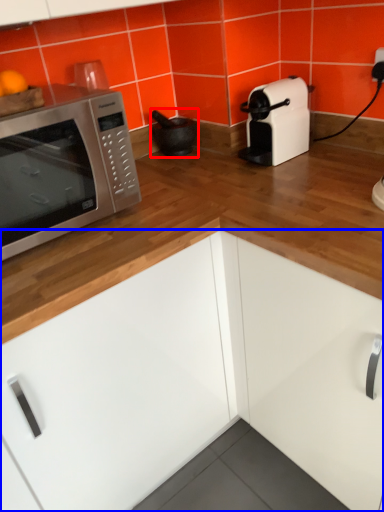
Question: Which point is further to the camera, appliance (highlighted by a red box) or cabinetry (highlighted by a blue box)?

Choices:
 (A) appliance
 (B) cabinetry

Answer: (A)